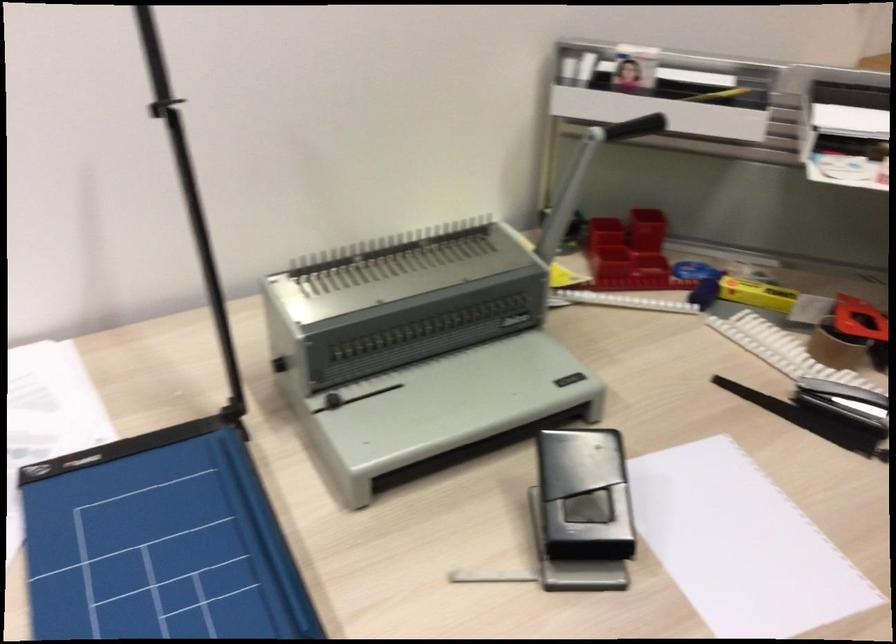
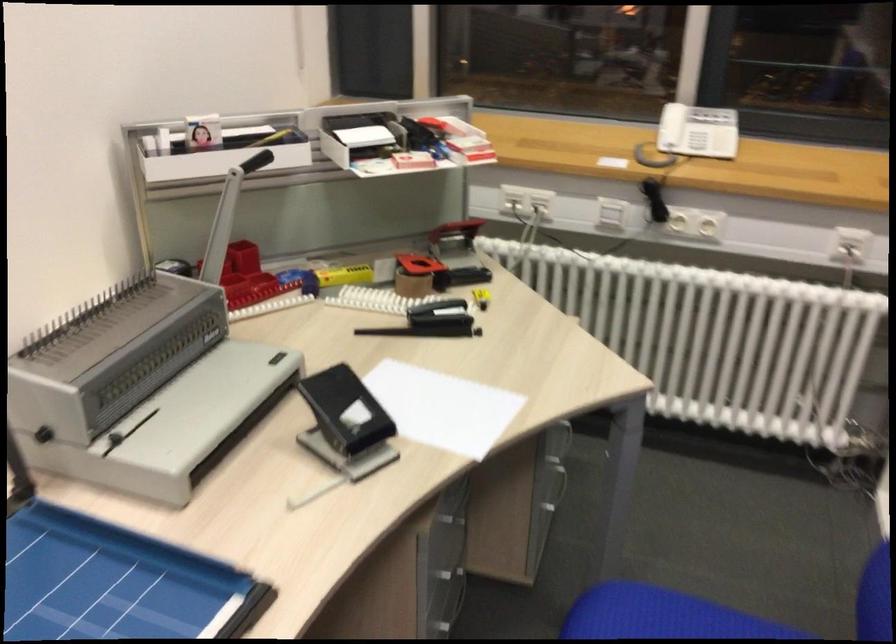
Locate, in the second image, the point that corresponds to point 622,251 in the first image.

(245, 277)